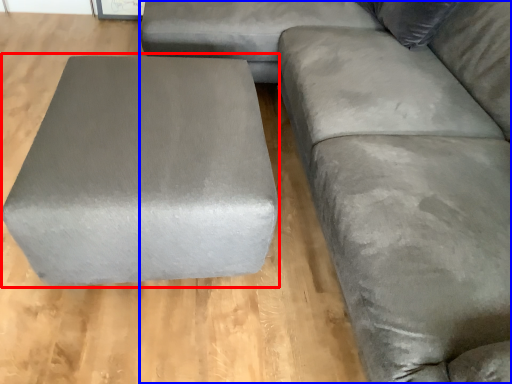
Question: Which object is further to the camera taking this photo, stool (highlighted by a red box) or studio couch (highlighted by a blue box)?

Choices:
 (A) stool
 (B) studio couch

Answer: (A)